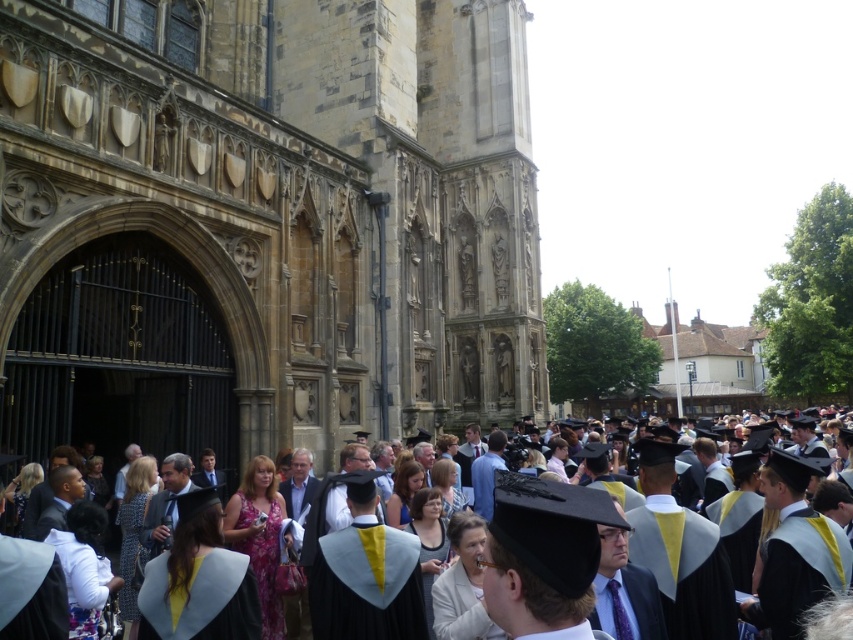
Which is below, brown stone church at center or light blue felt graduation gown at lower center?

Positioned lower is light blue felt graduation gown at lower center.

Can you confirm if brown stone church at center is positioned below light blue felt graduation gown at lower center?

Incorrect, brown stone church at center is not positioned below light blue felt graduation gown at lower center.

Is point (236, 128) positioned after point (212, 602)?

That is True.

Find the location of a particular element. The height and width of the screenshot is (640, 853). brown stone church at center is located at coordinates (264, 224).

Can you confirm if brown stone church at center is shorter than matte black graduation gown at center?

No, brown stone church at center is not shorter than matte black graduation gown at center.

Measure the distance between brown stone church at center and camera.

brown stone church at center is 134.03 feet away from camera.

Find the location of a particular element. Image resolution: width=853 pixels, height=640 pixels. brown stone church at center is located at coordinates (264, 224).

Consider the image. Which is more to the left, matte black graduation gown at center or light blue felt graduation gown at lower center?

light blue felt graduation gown at lower center is more to the left.

Is matte black graduation gown at center above light blue felt graduation gown at lower center?

Correct, matte black graduation gown at center is located above light blue felt graduation gown at lower center.

The image size is (853, 640). What do you see at coordinates (798, 547) in the screenshot?
I see `matte black graduation gown at center` at bounding box center [798, 547].

At what (x,y) coordinates should I click in order to perform the action: click on matte black graduation gown at center. Please return your answer as a coordinate pair (x, y). Looking at the image, I should click on (798, 547).